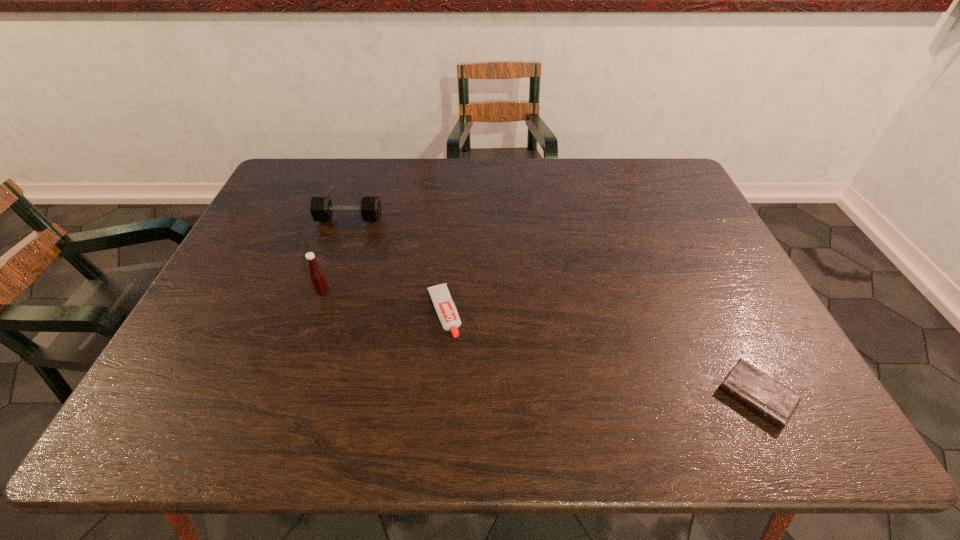
Where is `vacant space situated 0.160m on the back of the shortest object`? This screenshot has height=540, width=960. vacant space situated 0.160m on the back of the shortest object is located at coordinates (714, 309).

Where is `object located in the near edge section of the desktop`? The height and width of the screenshot is (540, 960). object located in the near edge section of the desktop is located at coordinates (x=776, y=403).

You are a GUI agent. You are given a task and a screenshot of the screen. Output one action in this format:
    pyautogui.click(x=<x>, y=<y>)
    Task: Click on the object that is positioned at the right edge
    The height and width of the screenshot is (540, 960).
    Given the screenshot: What is the action you would take?
    pyautogui.click(x=776, y=403)

Find the location of `object that is at the near right corner`. object that is at the near right corner is located at coordinates (x=776, y=403).

You are a GUI agent. You are given a task and a screenshot of the screen. Output one action in this format:
    pyautogui.click(x=<x>, y=<y>)
    Task: Click on the vacant space at the far edge
    This screenshot has height=540, width=960.
    Given the screenshot: What is the action you would take?
    pyautogui.click(x=399, y=186)

In the image, there is a desktop. Where is `vacant area at the near edge`? The height and width of the screenshot is (540, 960). vacant area at the near edge is located at coordinates (298, 424).

Find the location of a particular element. The height and width of the screenshot is (540, 960). free space at the left edge of the desktop is located at coordinates pyautogui.click(x=259, y=279).

At what (x,y) coordinates should I click in order to perform the action: click on vacant region at the right edge. Please return your answer as a coordinate pair (x, y). The width and height of the screenshot is (960, 540). Looking at the image, I should click on (777, 352).

This screenshot has height=540, width=960. I want to click on vacant space at the far right corner of the desktop, so click(663, 176).

This screenshot has width=960, height=540. Find the location of `vacant point located between the second tallest object and the nearest object`. vacant point located between the second tallest object and the nearest object is located at coordinates (553, 308).